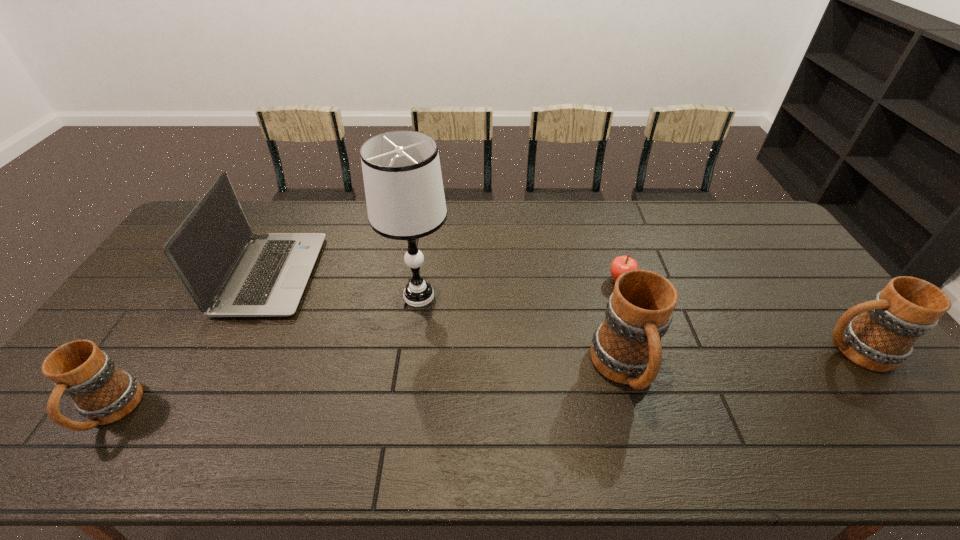
What are the coordinates of `empty space that is in between the second mug from left to right and the leftmost mug` in the screenshot? It's located at (368, 391).

Where is `object that ranks as the fifth closest to the leftmost mug`? The width and height of the screenshot is (960, 540). object that ranks as the fifth closest to the leftmost mug is located at coordinates [882, 337].

Point out which object is positioned as the second nearest to the leftmost mug. Please provide its 2D coordinates. Your answer should be formatted as a tuple, i.e. [(x, y)], where the tuple contains the x and y coordinates of a point satisfying the conditions above.

[(404, 191)]

Find the location of `the closest mug to the second mug from left to right`. the closest mug to the second mug from left to right is located at coordinates (882, 337).

The width and height of the screenshot is (960, 540). Identify the location of mug that is the third closest to the shortest object. (102, 393).

This screenshot has width=960, height=540. Find the location of `free region that satisfies the following two spatial constraints: 1. on the screen of the fifth object from right to left; 2. on the left side of the apple`. free region that satisfies the following two spatial constraints: 1. on the screen of the fifth object from right to left; 2. on the left side of the apple is located at coordinates (270, 281).

Locate an element on the screen. The width and height of the screenshot is (960, 540). free space that satisfies the following two spatial constraints: 1. on the side of the second tallest mug with the handle; 2. on the side of the fifth tallest object with the handle is located at coordinates (900, 412).

The width and height of the screenshot is (960, 540). I want to click on free space that satisfies the following two spatial constraints: 1. on the side of the third shortest object with the handle; 2. on the side of the second mug from right to left with the handle, so click(x=869, y=369).

This screenshot has width=960, height=540. I want to click on blank area in the image that satisfies the following two spatial constraints: 1. on the screen of the laptop computer; 2. on the right side of the shortest object, so click(270, 281).